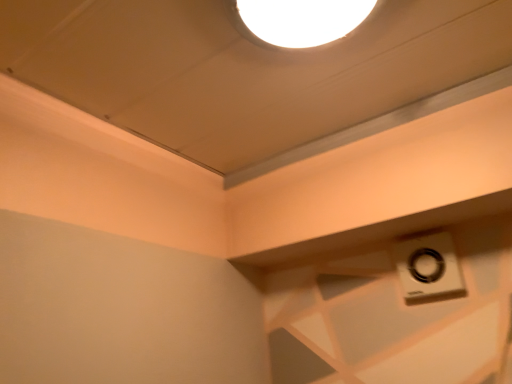
What is the approximate height of white plastic speaker at lower right?

The height of white plastic speaker at lower right is 6.71 inches.

At what (x,y) coordinates should I click in order to perform the action: click on white plastic speaker at lower right. Please return your answer as a coordinate pair (x, y). This screenshot has width=512, height=384. Looking at the image, I should click on (428, 267).

What do you see at coordinates (428, 267) in the screenshot? I see `white plastic speaker at lower right` at bounding box center [428, 267].

Find the location of a particular element. The height and width of the screenshot is (384, 512). white plastic speaker at lower right is located at coordinates (428, 267).